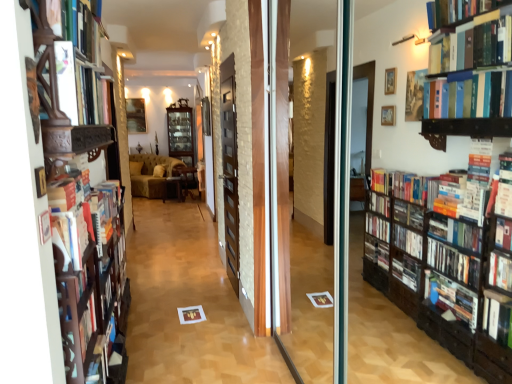
Question: Considering the relative positions of matte white book at upper left, which ranks as the 1th book in top-to-bottom order, and wooden table at center, the third furniture positioned from the left, in the image provided, is matte white book at upper left, which ranks as the 1th book in top-to-bottom order, behind wooden table at center, the third furniture positioned from the left,?

Choices:
 (A) yes
 (B) no

Answer: (B)

Question: From the image's perspective, is matte white book at upper left, which ranks as the 1th book in top-to-bottom order, above wooden table at center, the third furniture positioned from the left?

Choices:
 (A) no
 (B) yes

Answer: (B)

Question: Is matte white book at upper left, which ranks as the 1th book in top-to-bottom order, in front of wooden table at center, which appears as the 1th furniture when viewed from the right?

Choices:
 (A) no
 (B) yes

Answer: (B)

Question: Are matte white book at upper left, which ranks as the 1th book in top-to-bottom order, and wooden table at center, the third furniture positioned from the left, located far from each other?

Choices:
 (A) no
 (B) yes

Answer: (B)

Question: Does matte white book at upper left, which ranks as the 2th book in bottom-to-top order, have a smaller size compared to wooden table at center, the third furniture positioned from the left?

Choices:
 (A) yes
 (B) no

Answer: (A)

Question: Considering the positions of wooden side table at center, marked as the second furniture in a right-to-left arrangement, and wooden bookshelf at left in the image, is wooden side table at center, marked as the second furniture in a right-to-left arrangement, wider or thinner than wooden bookshelf at left?

Choices:
 (A) thin
 (B) wide

Answer: (B)

Question: In terms of height, does wooden side table at center, the 2th furniture when ordered from left to right, look taller or shorter compared to wooden bookshelf at left?

Choices:
 (A) tall
 (B) short

Answer: (B)

Question: Based on their sizes in the image, would you say wooden side table at center, marked as the second furniture in a right-to-left arrangement, is bigger or smaller than wooden bookshelf at left?

Choices:
 (A) big
 (B) small

Answer: (B)

Question: From the image's perspective, is wooden side table at center, marked as the second furniture in a right-to-left arrangement, above or below wooden bookshelf at left?

Choices:
 (A) below
 (B) above

Answer: (B)

Question: From a real-world perspective, relative to wooden table at center, the third furniture positioned from the left, is dark brown wooden screen door at center vertically above or below?

Choices:
 (A) above
 (B) below

Answer: (A)

Question: Is dark brown wooden screen door at center spatially inside wooden table at center, which appears as the 1th furniture when viewed from the right, or outside of it?

Choices:
 (A) inside
 (B) outside

Answer: (B)

Question: Would you say dark brown wooden screen door at center is to the left or to the right of wooden table at center, which appears as the 1th furniture when viewed from the right, in the picture?

Choices:
 (A) left
 (B) right

Answer: (B)

Question: In terms of width, does dark brown wooden screen door at center look wider or thinner when compared to wooden table at center, which appears as the 1th furniture when viewed from the right?

Choices:
 (A) wide
 (B) thin

Answer: (B)

Question: From a real-world perspective, is wooden side table at center, marked as the second furniture in a right-to-left arrangement, above or below velvet brown sofa at center, arranged as the first furniture when viewed from the left?

Choices:
 (A) above
 (B) below

Answer: (B)

Question: From the image's perspective, is wooden side table at center, the 2th furniture when ordered from left to right, located above or below velvet brown sofa at center, the 3th furniture from the right?

Choices:
 (A) above
 (B) below

Answer: (B)